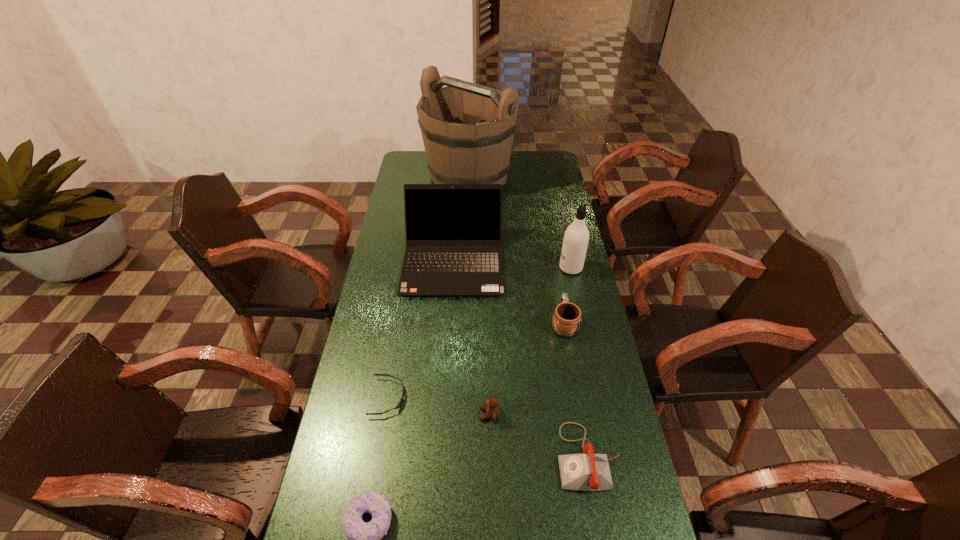
At what (x,y) coordinates should I click in order to perform the action: click on bucket. Please return your answer as a coordinate pair (x, y). Looking at the image, I should click on (467, 129).

Locate an element on the screen. the tallest object is located at coordinates (467, 129).

This screenshot has height=540, width=960. I want to click on the second tallest object, so click(x=576, y=237).

Locate an element on the screen. the sixth shortest object is located at coordinates (453, 231).

You are a GUI agent. You are given a task and a screenshot of the screen. Output one action in this format:
    pyautogui.click(x=<x>, y=<y>)
    Task: Click on the mug
    
    Given the screenshot: What is the action you would take?
    pyautogui.click(x=567, y=318)

Where is `teddy bear`? teddy bear is located at coordinates (492, 408).

Find the location of a particular element. This screenshot has height=540, width=960. the third shortest object is located at coordinates point(588,471).

You are a GUI agent. You are given a task and a screenshot of the screen. Output one action in this format:
    pyautogui.click(x=<x>, y=<y>)
    Task: Click on the sunglasses
    
    Given the screenshot: What is the action you would take?
    (399, 404)

Locate an element on the screen. The image size is (960, 540). vacant space located on the front of the bucket is located at coordinates (468, 221).

Where is `free location located on the front-facing side of the second tallest object`? The width and height of the screenshot is (960, 540). free location located on the front-facing side of the second tallest object is located at coordinates (523, 268).